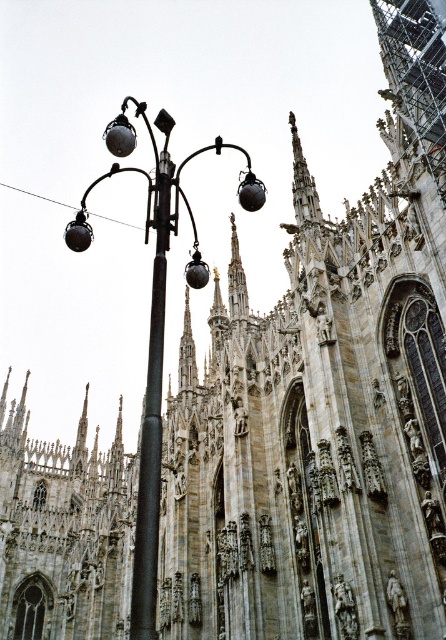
The height and width of the screenshot is (640, 446). Find the location of `matte black street light at left`. matte black street light at left is located at coordinates (155, 326).

Who is more forward, (144, 454) or (144, 568)?

Point (144, 568) is in front.

This screenshot has height=640, width=446. I want to click on matte black street light at left, so click(x=155, y=326).